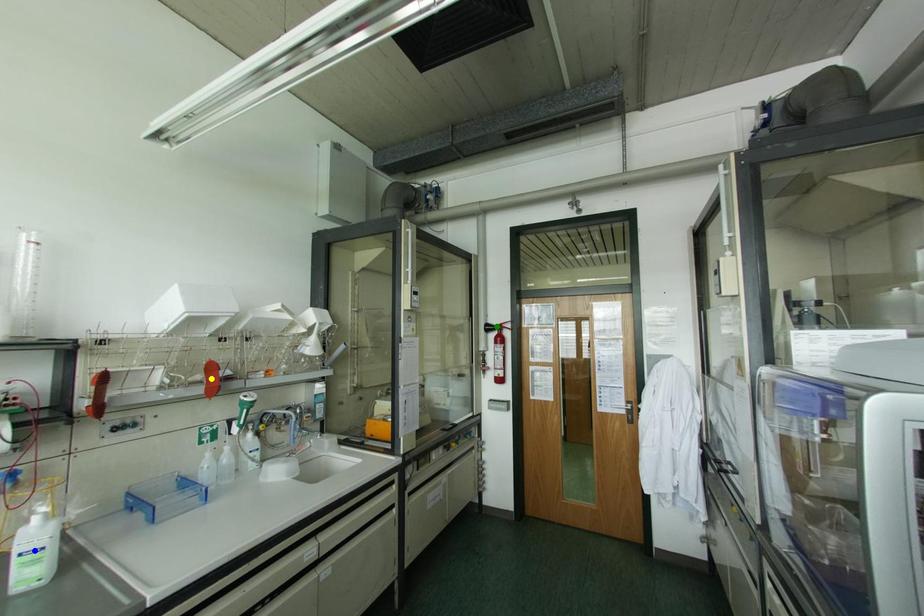
Order these from nearest to farthest:
- blue point
- green point
- yellow point

blue point < yellow point < green point